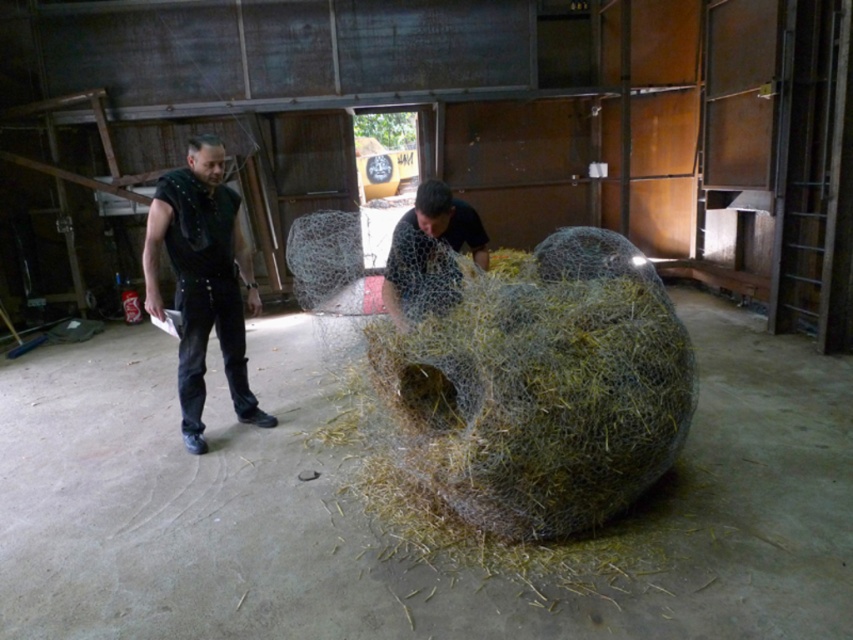
Question: Is black studded leather vest at left positioned at the back of mesh fabric figure at center?

Choices:
 (A) no
 (B) yes

Answer: (B)

Question: Does black studded leather vest at left have a smaller size compared to mesh fabric figure at center?

Choices:
 (A) no
 (B) yes

Answer: (A)

Question: Which of the following is the farthest from the observer?

Choices:
 (A) mesh fabric figure at center
 (B) black studded leather vest at left
 (C) natural straw sculpture at center

Answer: (B)

Question: Which point is farther to the camera?

Choices:
 (A) mesh fabric figure at center
 (B) black studded leather vest at left

Answer: (B)

Question: Does natural straw sculpture at center have a lesser width compared to black studded leather vest at left?

Choices:
 (A) no
 (B) yes

Answer: (A)

Question: Among these objects, which one is nearest to the camera?

Choices:
 (A) black studded leather vest at left
 (B) mesh fabric figure at center
 (C) natural straw sculpture at center

Answer: (C)